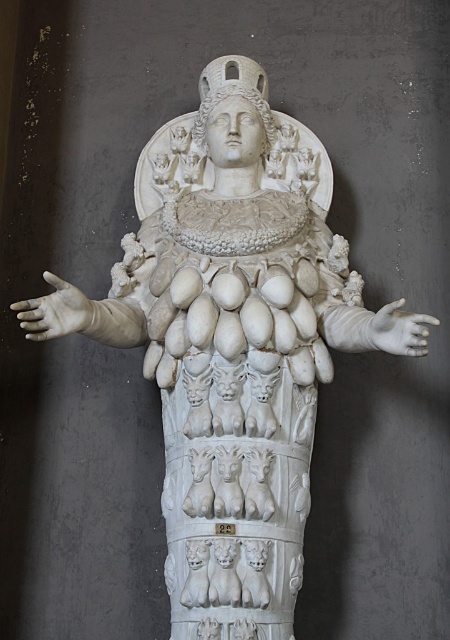
Question: Which object appears farthest from the camera in this image?

Choices:
 (A) white marble hand at center
 (B) white matte hand at left

Answer: (B)

Question: Observing the image, what is the correct spatial positioning of white matte hand at left in reference to white marble hand at center?

Choices:
 (A) above
 (B) below

Answer: (A)

Question: Is white matte hand at left above white marble hand at center?

Choices:
 (A) yes
 (B) no

Answer: (A)

Question: Can you confirm if white matte hand at left is wider than white marble hand at center?

Choices:
 (A) no
 (B) yes

Answer: (B)